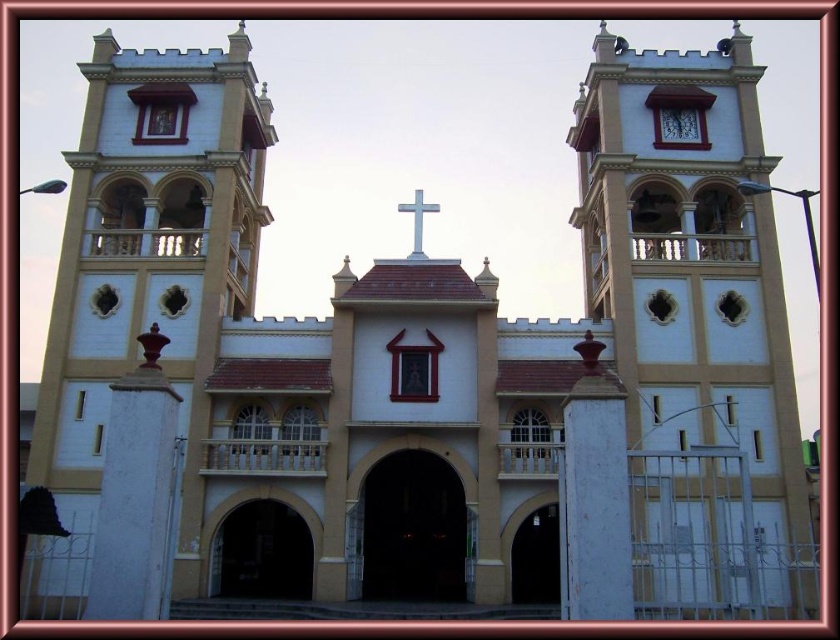
Question: From the image, what is the correct spatial relationship of matte white tower at center in relation to white matte cross at center?

Choices:
 (A) below
 (B) above

Answer: (A)

Question: Observing the image, what is the correct spatial positioning of matte white tower at center in reference to matte white clock at upper center?

Choices:
 (A) below
 (B) above

Answer: (A)

Question: Is matte yellow tower at center above matte white clock at upper center?

Choices:
 (A) no
 (B) yes

Answer: (A)

Question: Based on their relative distances, which object is farther from the white matte cross at center?

Choices:
 (A) matte white tower at center
 (B) matte yellow tower at center
 (C) matte white clock at upper center

Answer: (A)

Question: Which object appears farthest from the camera in this image?

Choices:
 (A) white matte cross at center
 (B) matte yellow tower at center
 (C) matte white clock at upper center

Answer: (C)

Question: Among these points, which one is nearest to the camera?

Choices:
 (A) (424, 208)
 (B) (694, 145)
 (C) (147, 182)

Answer: (C)